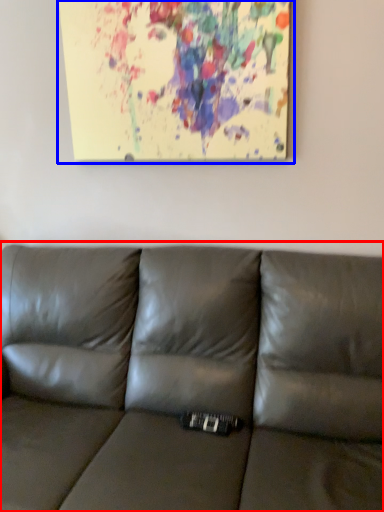
Question: Which object is further to the camera taking this photo, studio couch (highlighted by a red box) or oil painting (highlighted by a blue box)?

Choices:
 (A) studio couch
 (B) oil painting

Answer: (B)